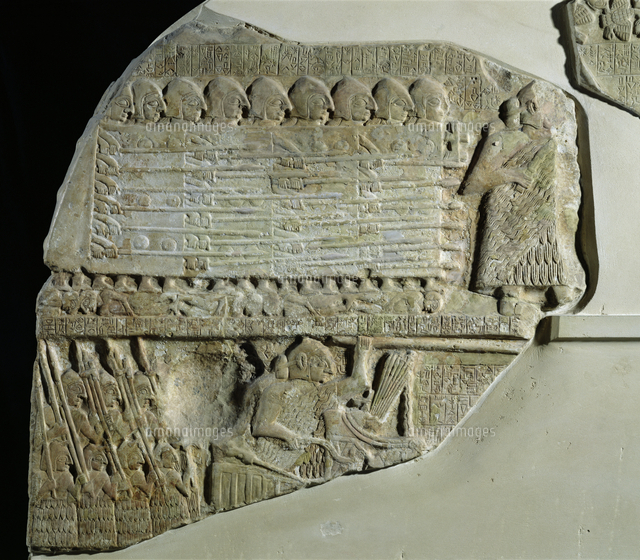
This screenshot has height=560, width=640. Identify the location of corner. (612, 57).